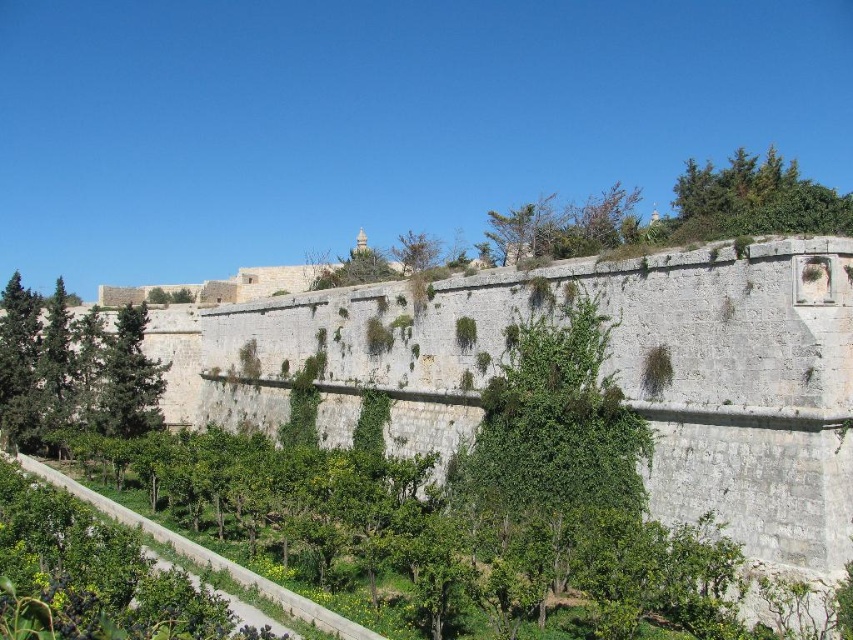
Is green leafy tree at center positioned before green leafy tree at upper right?

Yes.

Who is lower down, green leafy tree at center or green leafy tree at upper right?

Positioned lower is green leafy tree at center.

This screenshot has height=640, width=853. In order to click on green leafy tree at center in this screenshot , I will do `click(550, 444)`.

Is point (10, 308) positioned before point (747, 180)?

No, it is behind (747, 180).

Does point (39, 387) lie behind point (780, 176)?

Yes, it is behind point (780, 176).

Identify the location of green leafy tree at upper left. (73, 371).

In the scene shown: Does green leafy tree at upper left lie in front of green leafy tree at left?

Yes.

Who is more distant from viewer, (9, 356) or (142, 365)?

Positioned behind is point (9, 356).

You are a GUI agent. You are given a task and a screenshot of the screen. Output one action in this format:
    pyautogui.click(x=<x>, y=<y>)
    Task: Click on the green leafy tree at upper left
    Image resolution: width=853 pixels, height=640 pixels.
    Given the screenshot: What is the action you would take?
    pyautogui.click(x=73, y=371)